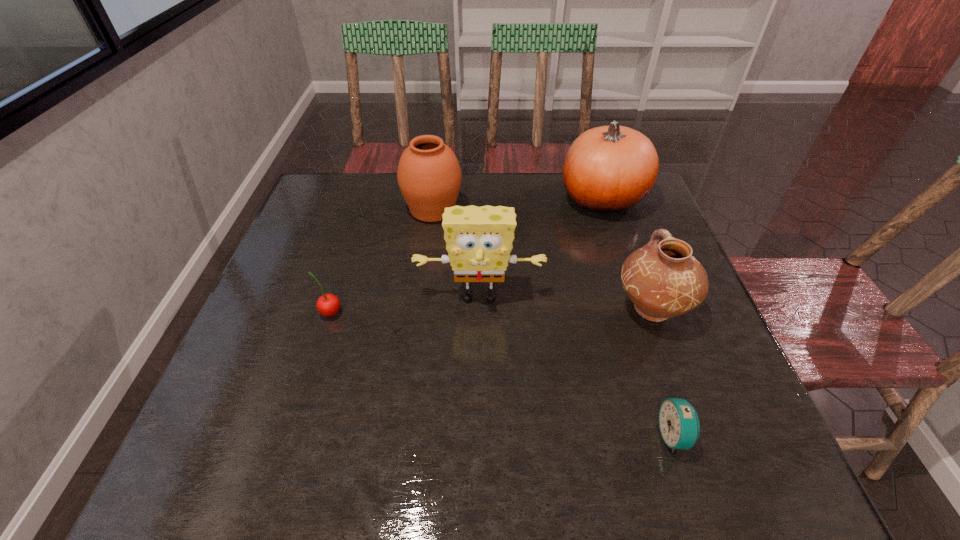
This screenshot has width=960, height=540. Find the location of `free space at the far left corner of the desktop`. free space at the far left corner of the desktop is located at coordinates (365, 189).

In order to click on vacant region at the near right corner of the desktop in this screenshot , I will do `click(699, 477)`.

This screenshot has width=960, height=540. I want to click on empty space that is in between the shortest object and the leftmost object, so click(x=502, y=374).

What are the coordinates of `empty location between the cherry and the urn` in the screenshot? It's located at (381, 261).

Identify the location of vacant region between the cherry and the nearest object. (502, 374).

Where is `free area in between the leftmost object and the urn`? This screenshot has width=960, height=540. free area in between the leftmost object and the urn is located at coordinates (381, 261).

Locate an element on the screen. Image resolution: width=960 pixels, height=540 pixels. free area in between the leftmost object and the shortest object is located at coordinates (502, 374).

At what (x,y) coordinates should I click in order to perform the action: click on object that is the nearest to the urn. Please return your answer as a coordinate pair (x, y). The height and width of the screenshot is (540, 960). Looking at the image, I should click on point(479,240).

The height and width of the screenshot is (540, 960). What are the coordinates of `object identified as the fourth closest to the leftmost object` in the screenshot? It's located at (607, 169).

Find the location of `free space that satisfies the following two spatial constraints: 1. on the back side of the urn; 2. on the left side of the pumpkin`. free space that satisfies the following two spatial constraints: 1. on the back side of the urn; 2. on the left side of the pumpkin is located at coordinates (434, 198).